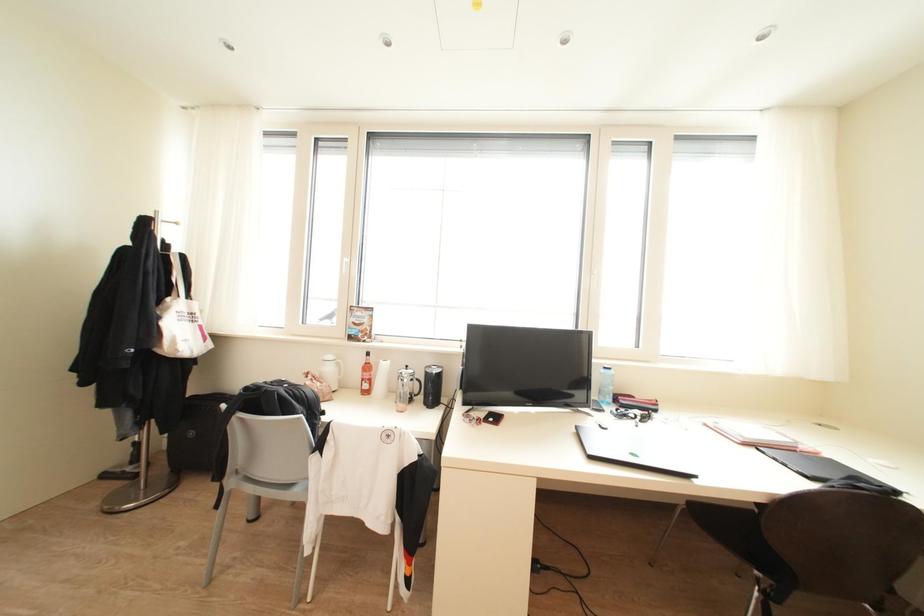
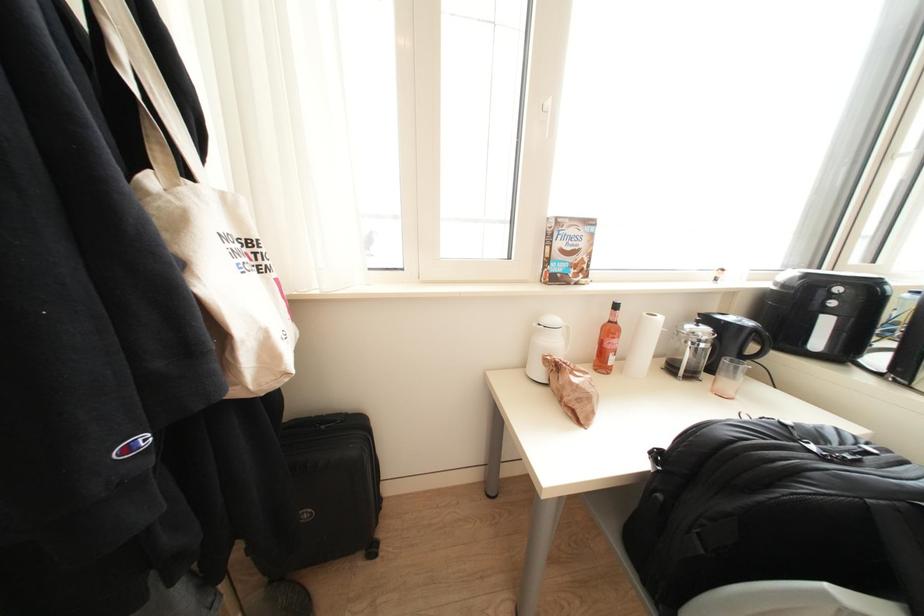
Which direction would the cameraman need to move to produce the second image?

The cameraman moved toward left, forward.